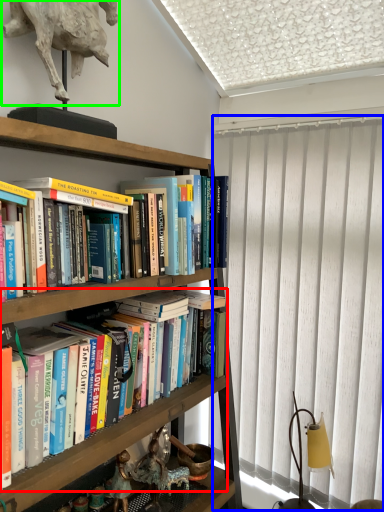
Question: Based on their relative distances, which object is farther from book (highlighted by a red box)? Choose from curtain (highlighted by a blue box) and animal (highlighted by a green box).

Choices:
 (A) curtain
 (B) animal

Answer: (B)